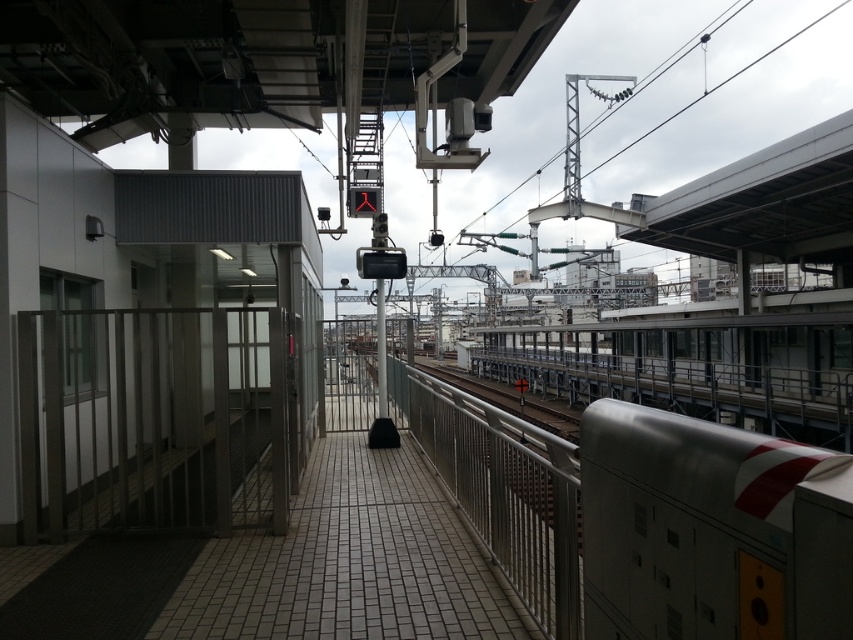
You are a maintenance worker who needs to inspect the distance between the silver metallic train at right and the satin silver rail at center. According to the image, how far apart are they?

The silver metallic train at right and the satin silver rail at center are 13.66 feet apart from each other.

You are a maintenance worker on the platform and need to access the metallic gate at left and the silver metallic train at right. Which object is taller and requires a ladder to reach its top?

The metallic gate at left is taller than the silver metallic train at right, so you would need a ladder to reach the top of the metallic gate at left.